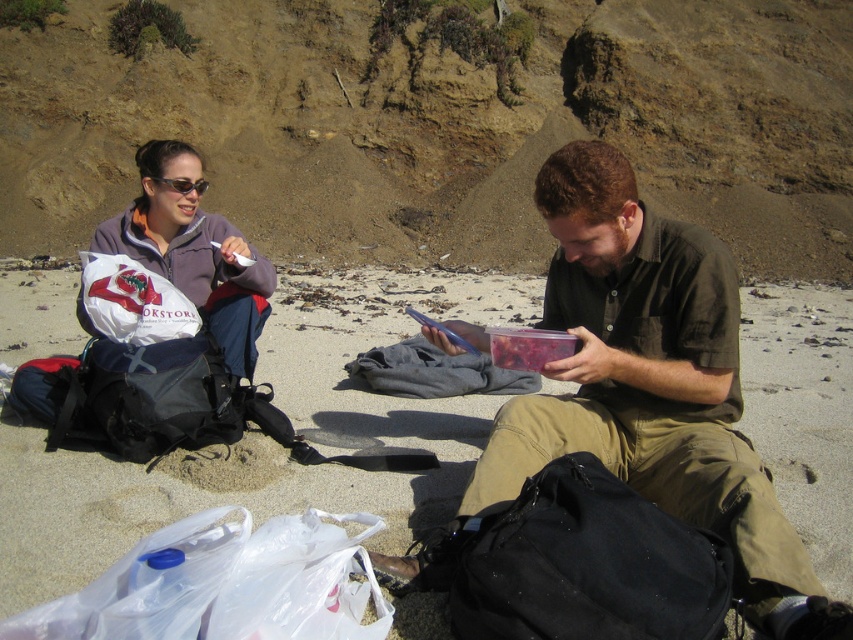
You are a photographer trying to capture a photo of the matte green shirt at center and the matte purple jacket at upper left. Which object should you focus on first if you want to ensure both are in focus without adjusting your camera settings?

The matte green shirt at center is taller than the matte purple jacket at upper left, so focusing on the taller matte green shirt at center first would help ensure both are in focus since it is further away and requires a greater depth of field.

You are a beach photographer trying to capture a wide shot of the scene. You notice the matte plastic container at center and the matte green shirt at center. Which object is wider in the image?

The matte plastic container at center is wider than the matte green shirt at center.

Looking at this image, you are a photographer taking a picture of the beach scene. You notice the matte plastic container at center and the matte green shirt at center. Which object should you focus on first if you want to capture both in sharp focus without moving the camera?

The matte plastic container at center is located above the matte green shirt at center. Since both objects are at the same horizontal center position but different vertical positions, you can focus on the matte green shirt at center first as it is lower, allowing the matte plastic container at center to be in focus due to the depth of field typically being sharper towards the center of the frame.